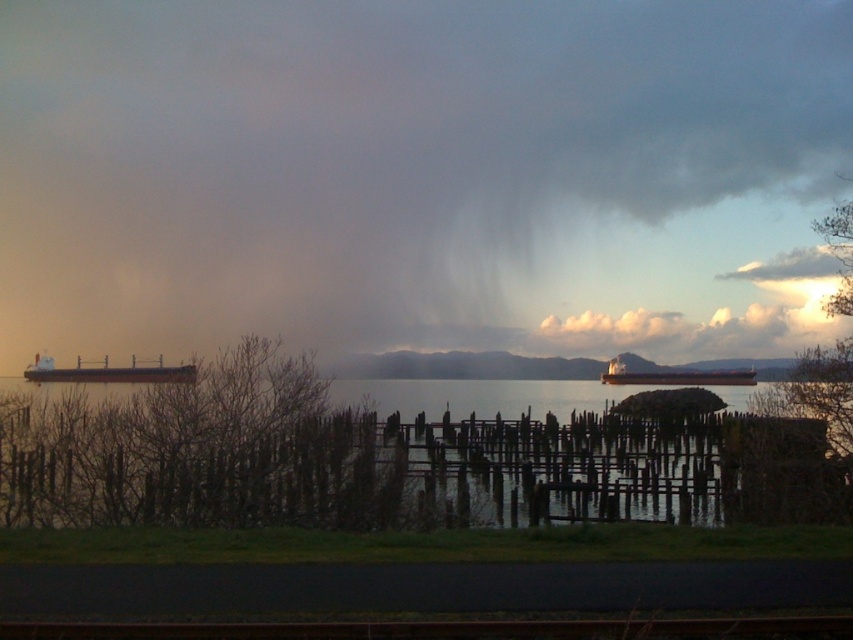
Can you confirm if gray matte cloud at upper center is bigger than metallic gray ship at center?

Indeed, gray matte cloud at upper center has a larger size compared to metallic gray ship at center.

Which is below, gray matte cloud at upper center or metallic gray ship at center?

metallic gray ship at center

The width and height of the screenshot is (853, 640). Find the location of `gray matte cloud at upper center`. gray matte cloud at upper center is located at coordinates (421, 173).

At what (x,y) coordinates should I click in order to perform the action: click on gray matte cloud at upper center. Please return your answer as a coordinate pair (x, y). This screenshot has width=853, height=640. Looking at the image, I should click on click(x=421, y=173).

Does black metal train track at center appear on the right side of brown matte cargo ship at left?

Correct, you'll find black metal train track at center to the right of brown matte cargo ship at left.

Can you confirm if black metal train track at center is positioned below brown matte cargo ship at left?

Correct, black metal train track at center is located below brown matte cargo ship at left.

Is point (225, 628) less distant than point (50, 374)?

Yes.

Image resolution: width=853 pixels, height=640 pixels. In order to click on black metal train track at center in this screenshot , I will do `click(444, 628)`.

Who is lower down, transparent water at center or metallic gray ship at center?

transparent water at center is lower down.

Can you confirm if transparent water at center is shorter than metallic gray ship at center?

No, transparent water at center is not shorter than metallic gray ship at center.

Who is more distant from viewer, [737,461] or [622,376]?

The point [622,376] is behind.

You are a GUI agent. You are given a task and a screenshot of the screen. Output one action in this format:
    pyautogui.click(x=<x>, y=<y>)
    Task: Click on the transparent water at center
    
    Given the screenshot: What is the action you would take?
    pyautogui.click(x=402, y=464)